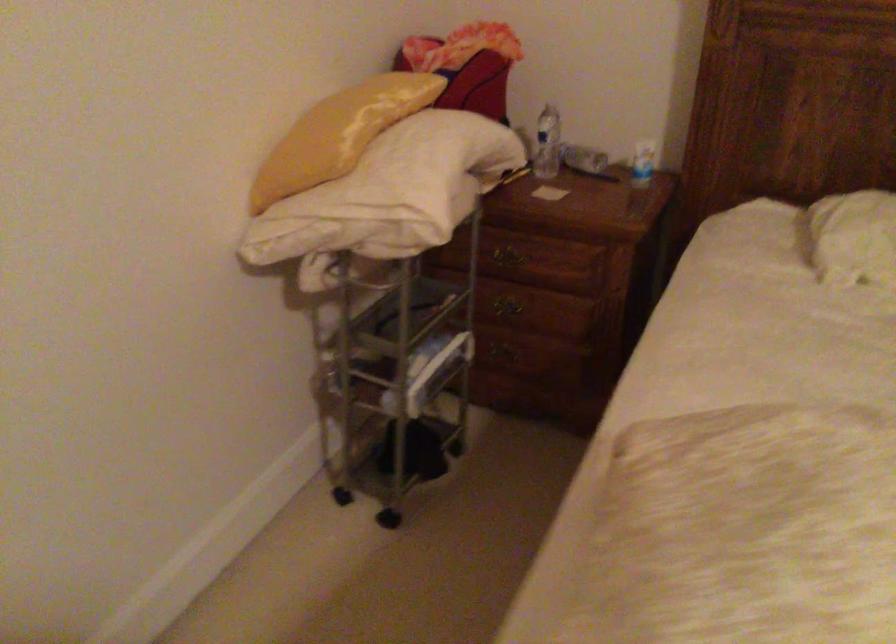
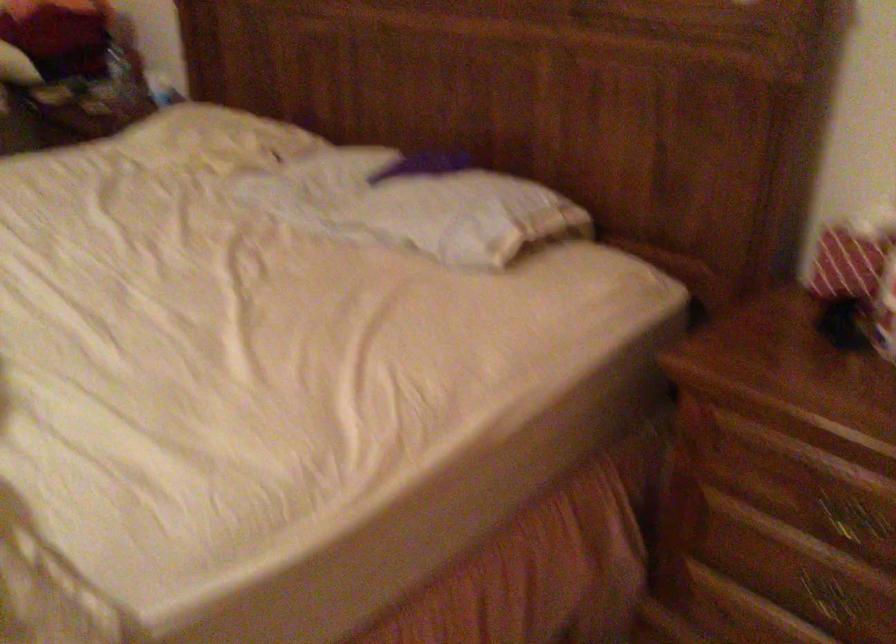
Question: The images are taken continuously from a first-person perspective. In which direction are you moving?

Choices:
 (A) Left
 (B) Right
 (C) Forward
 (D) Backward

Answer: (B)